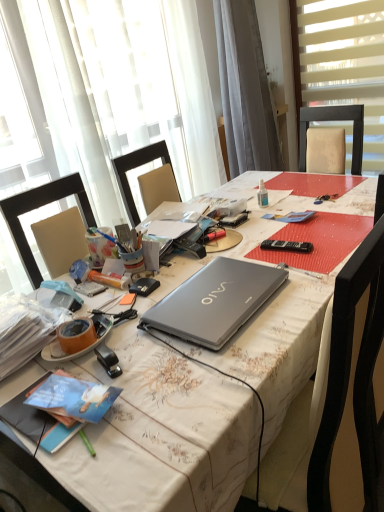
Identify the location of vacant space in front of black plastic stapler at lower left. Image resolution: width=384 pixels, height=512 pixels. (126, 415).